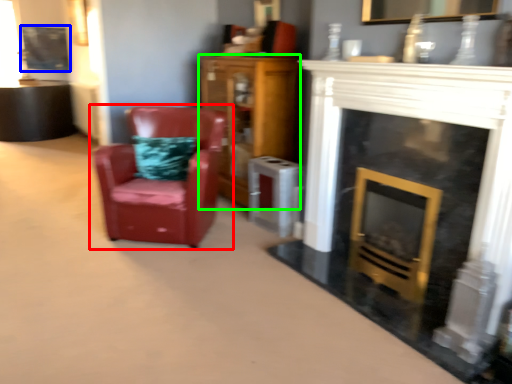
Question: Which is farther away from chair (highlighted by a red box)? picture frame (highlighted by a blue box) or cabinetry (highlighted by a green box)?

Choices:
 (A) picture frame
 (B) cabinetry

Answer: (A)